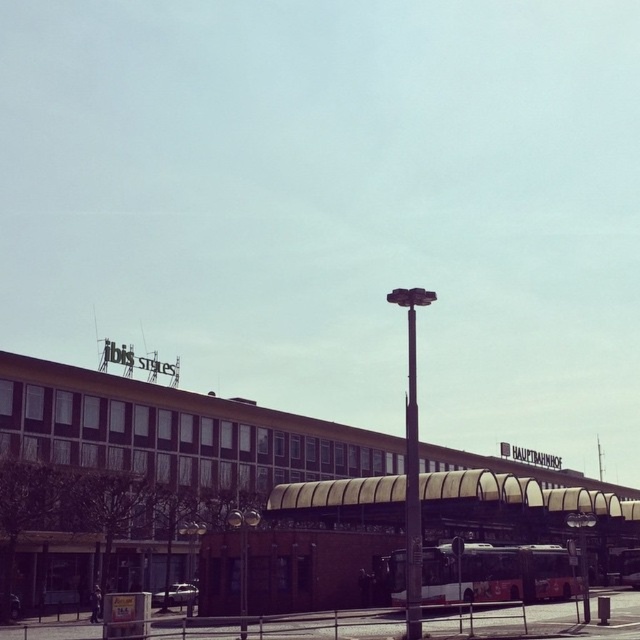
You are a city planner trying to install a new streetlight between the white glass bus station at center and the black metal pole at center. Given their sizes, which object should the new streetlight be placed closer to to ensure enough space?

The white glass bus station at center is wider than the black metal pole at center. Therefore, the new streetlight should be placed closer to the black metal pole at center to ensure sufficient space.

You are standing at the intersection and want to find the bus stop. You see a white glass bus station at center and a black metal pole at center. Which one is located to the right of the other?

The white glass bus station at center is to the right of the black metal pole at center.